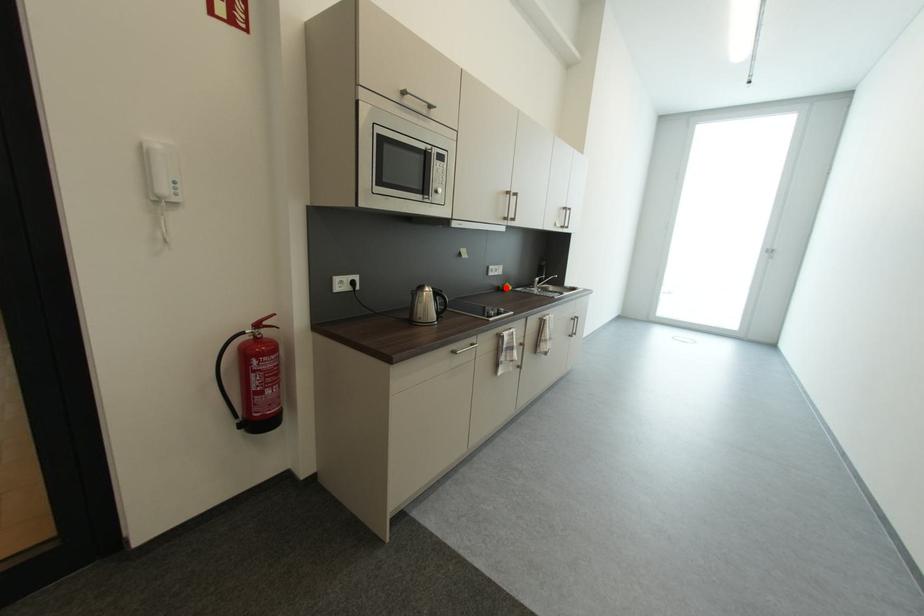
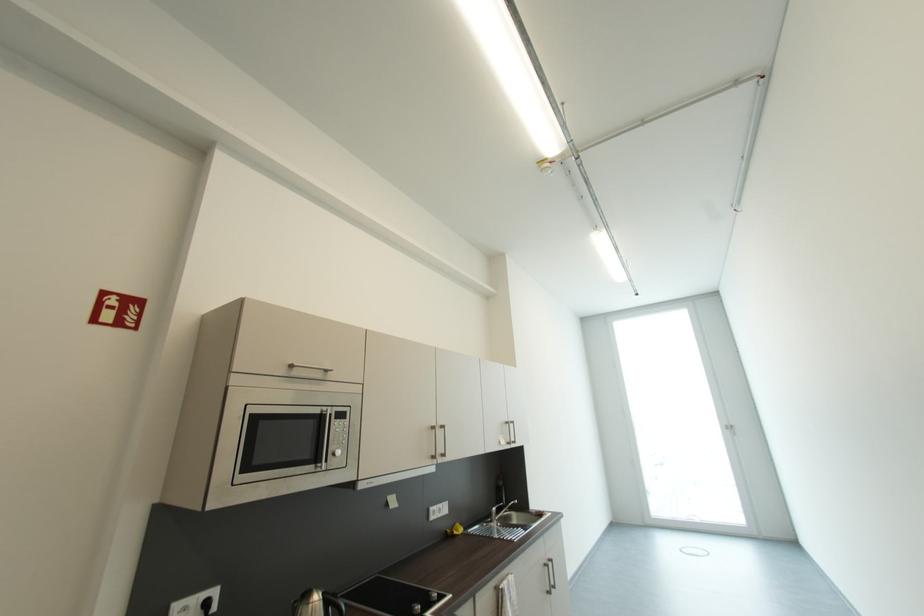
Question: I am providing you with two images of the same scene from different viewpoints. Image1 has a red point marked. In image2, the corresponding 3D location appears at what relative position? Reply with the corresponding letter.

Choices:
 (A) Closer
 (B) Farther

Answer: (B)